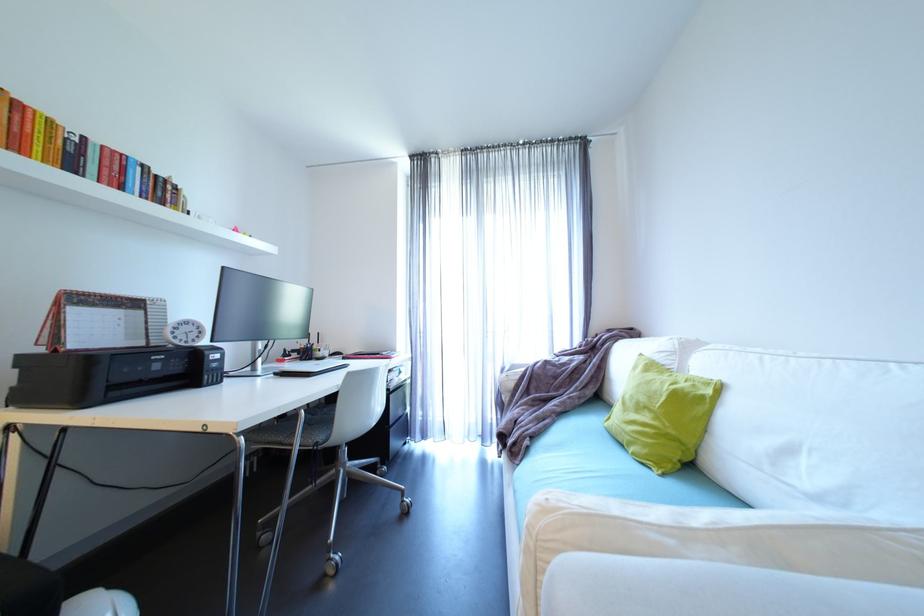
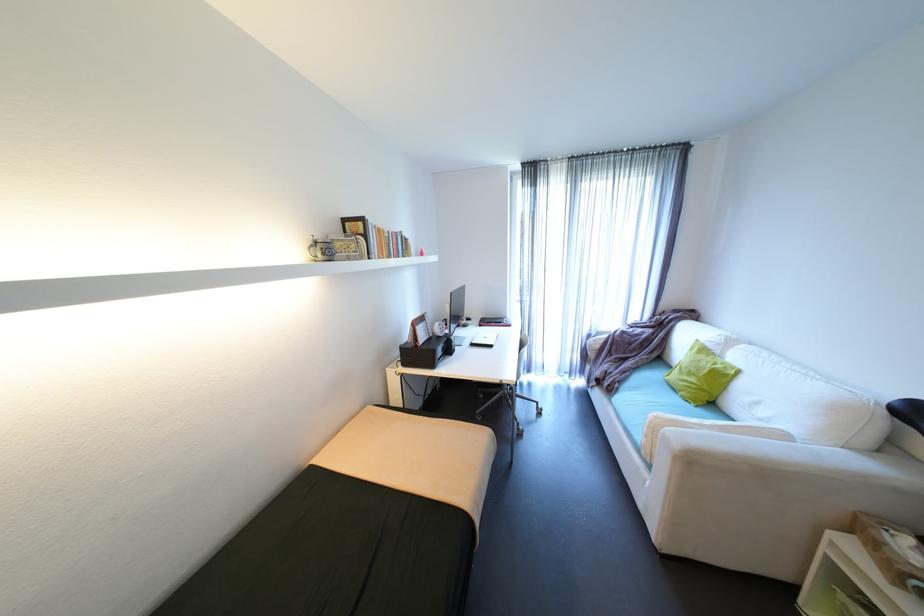
Where in the second image is the point corresponding to the point at 728,387 from the first image?

(747, 371)